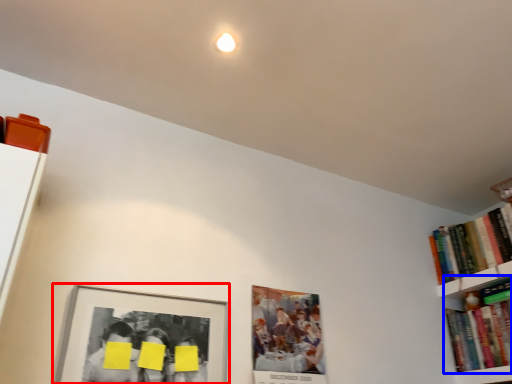
Question: Which object appears closest to the camera in this image, picture frame (highlighted by a red box) or book (highlighted by a blue box)?

Choices:
 (A) picture frame
 (B) book

Answer: (A)